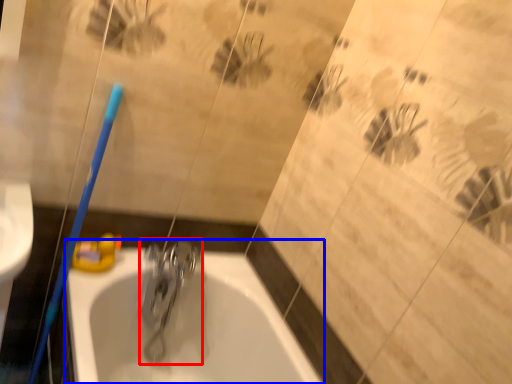
Question: Which object is closer to the camera taking this photo, tap (highlighted by a red box) or bathtub (highlighted by a blue box)?

Choices:
 (A) tap
 (B) bathtub

Answer: (B)